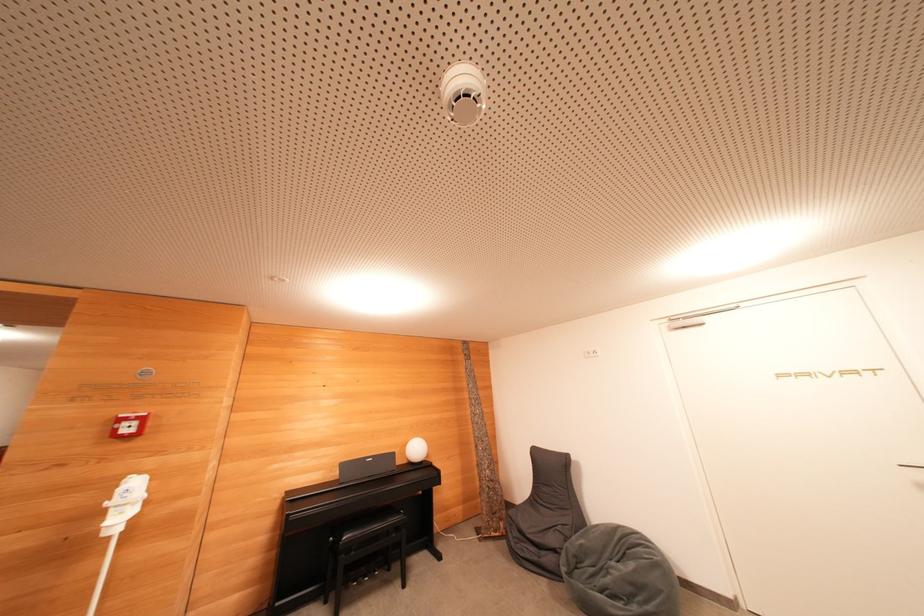
The location [128,424] corresponds to which object?

This point indicates the red fire alarm.